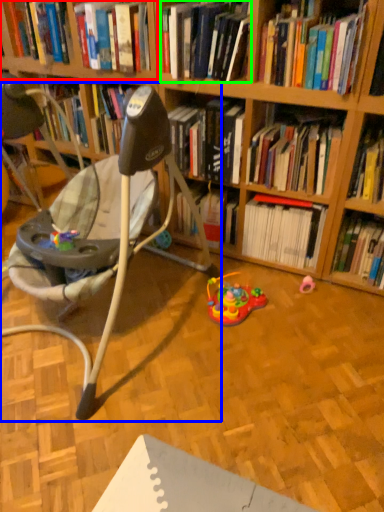
Question: Which is farther away from shelf (highlighted by a red box)? chair (highlighted by a blue box) or book (highlighted by a green box)?

Choices:
 (A) chair
 (B) book

Answer: (A)